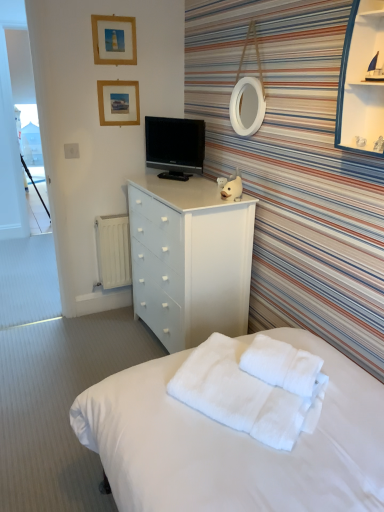
Question: Is wooden picture frame at upper center, placed as the second picture frame when sorted from top to bottom, shorter than transparent glass cabinet at upper right?

Choices:
 (A) yes
 (B) no

Answer: (A)

Question: Is wooden picture frame at upper center, placed as the second picture frame when sorted from top to bottom, not within transparent glass cabinet at upper right?

Choices:
 (A) yes
 (B) no

Answer: (A)

Question: Is wooden picture frame at upper center, placed as the second picture frame when sorted from top to bottom, looking in the opposite direction of transparent glass cabinet at upper right?

Choices:
 (A) no
 (B) yes

Answer: (A)

Question: Does wooden picture frame at upper center, the 1th picture frame ordered from the bottom, appear on the right side of transparent glass cabinet at upper right?

Choices:
 (A) yes
 (B) no

Answer: (B)

Question: Considering the relative sizes of wooden picture frame at upper center, the 1th picture frame ordered from the bottom, and transparent glass cabinet at upper right in the image provided, is wooden picture frame at upper center, the 1th picture frame ordered from the bottom, wider than transparent glass cabinet at upper right?

Choices:
 (A) yes
 (B) no

Answer: (B)

Question: From a real-world perspective, relative to white matte chest of drawers at center, is white matte radiator at left vertically above or below?

Choices:
 (A) above
 (B) below

Answer: (B)

Question: Is white matte radiator at left inside or outside of white matte chest of drawers at center?

Choices:
 (A) outside
 (B) inside

Answer: (A)

Question: Considering their positions, is white matte radiator at left located in front of or behind white matte chest of drawers at center?

Choices:
 (A) front
 (B) behind

Answer: (B)

Question: Considering the positions of white matte radiator at left and white matte chest of drawers at center in the image, is white matte radiator at left taller or shorter than white matte chest of drawers at center?

Choices:
 (A) tall
 (B) short

Answer: (B)

Question: In terms of height, does white fluffy blanket at lower center look taller or shorter compared to wooden picture frame at upper center, the 1th picture frame ordered from the bottom?

Choices:
 (A) short
 (B) tall

Answer: (A)

Question: From a real-world perspective, is white fluffy blanket at lower center above or below wooden picture frame at upper center, the 1th picture frame ordered from the bottom?

Choices:
 (A) below
 (B) above

Answer: (A)

Question: Is white fluffy blanket at lower center to the left or to the right of wooden picture frame at upper center, placed as the second picture frame when sorted from top to bottom, in the image?

Choices:
 (A) right
 (B) left

Answer: (A)

Question: From the image's perspective, is white fluffy blanket at lower center located above or below wooden picture frame at upper center, the 1th picture frame ordered from the bottom?

Choices:
 (A) above
 (B) below

Answer: (B)

Question: From a real-world perspective, is transparent glass cabinet at upper right positioned above or below white fluffy blanket at lower center?

Choices:
 (A) above
 (B) below

Answer: (A)

Question: In the image, is transparent glass cabinet at upper right on the left side or the right side of white fluffy blanket at lower center?

Choices:
 (A) right
 (B) left

Answer: (A)